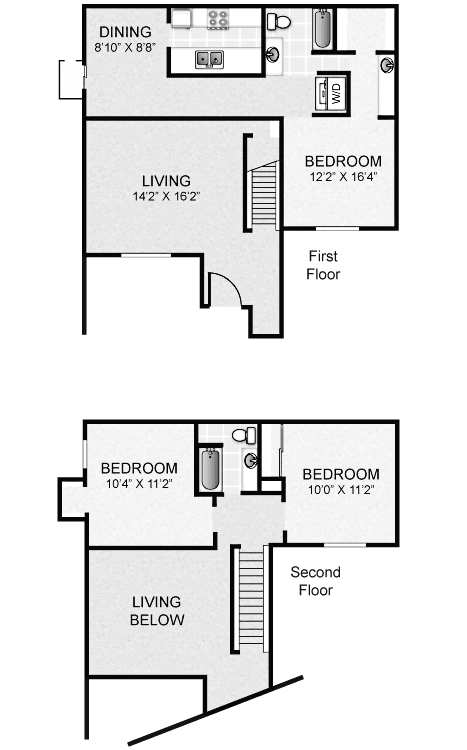
Find the location of a particular element. This screenshot has height=750, width=467. sinks is located at coordinates (201, 58), (215, 56), (274, 52), (386, 62), (249, 459).